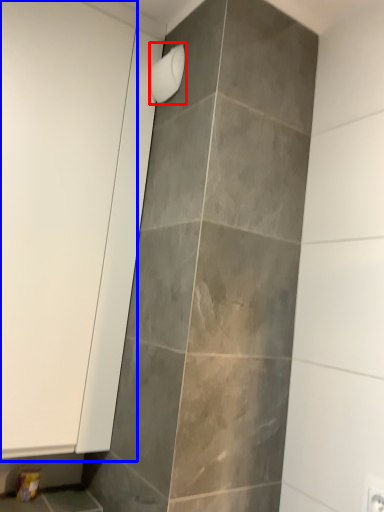
Question: Which object appears farthest to the camera in this image, shower (highlighted by a red box) or screen door (highlighted by a blue box)?

Choices:
 (A) shower
 (B) screen door

Answer: (A)